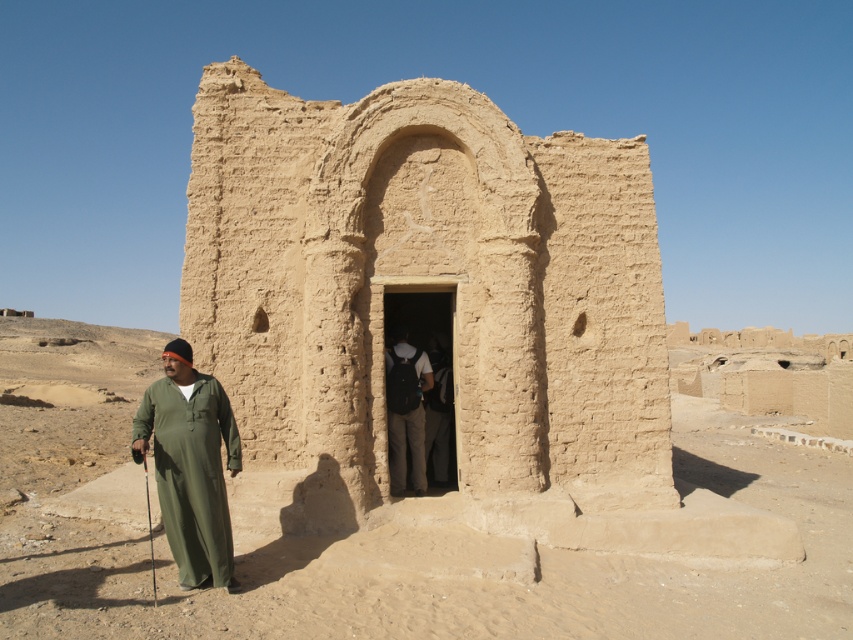
You are standing at the entrance of the earthy clay ruins at center. You want to walk to the point marked at coordinates (426, 291). Is that point inside the ruins?

The point at coordinates (426, 291) is located at the earthy clay ruins at center, so yes, the point is inside the ruins.

You are a traveler carrying a dark gray fabric backpack at center and standing near the earthy clay ruins at center. If you want to pass through the ruins, would the width of the ruins be sufficient for your backpack?

The earthy clay ruins at center are wider than the dark gray fabric backpack at center, so the ruins are wide enough to allow passage with the backpack.